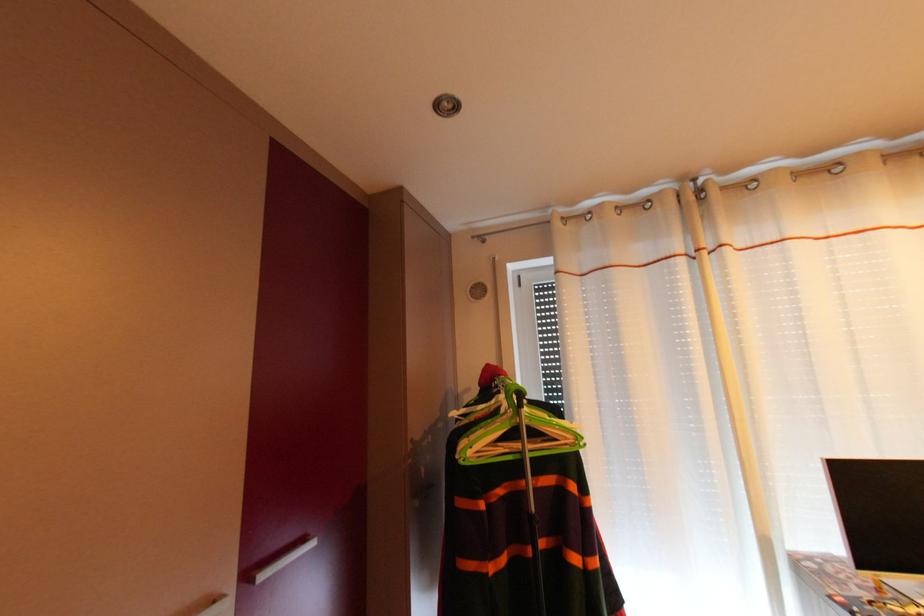
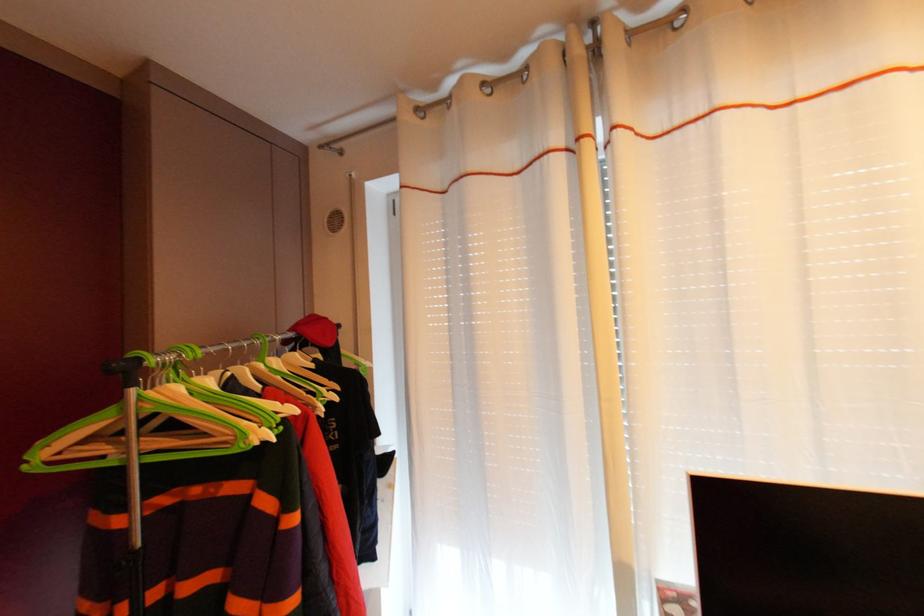
Which direction would the cameraman need to move to produce the second image?

The movement direction of the cameraman is right, forward.